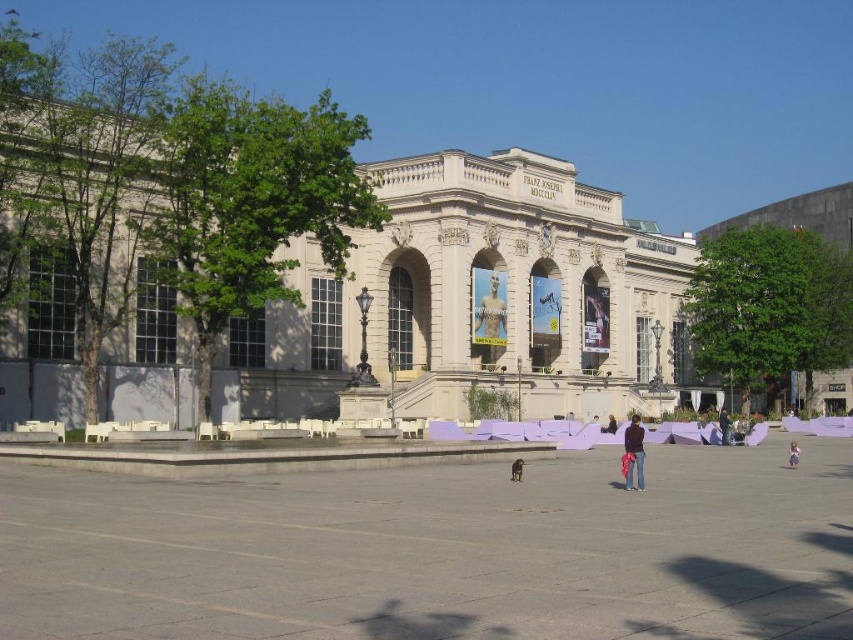
Question: Can you confirm if purple cotton pants at center is positioned above dark blue jeans at center?

Choices:
 (A) no
 (B) yes

Answer: (B)

Question: Which object is farther from the camera taking this photo?

Choices:
 (A) pink fabric at center
 (B) dark blue jeans at center
 (C) smooth bronze statue at center

Answer: (C)

Question: Estimate the real-world distances between objects in this image. Which object is closer to the purple cotton pants at center?

Choices:
 (A) black leather jacket at center
 (B) smooth bronze statue at center

Answer: (A)

Question: Can you confirm if smooth bronze statue at center is positioned to the left of dark blue jeans at center?

Choices:
 (A) yes
 (B) no

Answer: (A)

Question: Which point is closer to the camera taking this photo?

Choices:
 (A) pyautogui.click(x=791, y=451)
 (B) pyautogui.click(x=720, y=408)
 (C) pyautogui.click(x=500, y=332)

Answer: (A)

Question: Considering the relative positions of purple cotton pants at center and dark blue jeans at center in the image provided, where is purple cotton pants at center located with respect to dark blue jeans at center?

Choices:
 (A) above
 (B) below

Answer: (A)